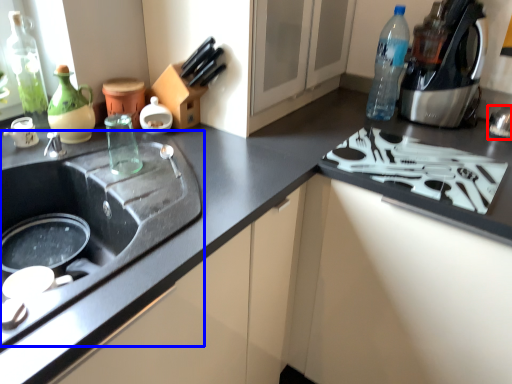
Question: Which of the following is the closest to the observer, appliance (highlighted by a red box) or sink (highlighted by a blue box)?

Choices:
 (A) appliance
 (B) sink

Answer: (B)